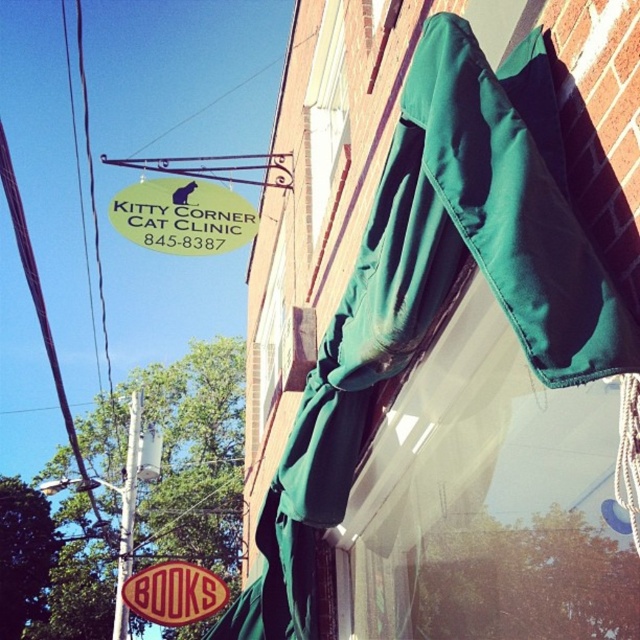
Question: Can you confirm if green fabric sign at upper left is bigger than metallic pole at upper left?

Choices:
 (A) no
 (B) yes

Answer: (A)

Question: Which object is positioned closest to the green fabric sign at upper left?

Choices:
 (A) metallic pole at upper left
 (B) red plastic books at lower center
 (C) green fabric awning at upper center
 (D) green fabric awning at upper right

Answer: (C)

Question: Which point appears farthest from the camera in this image?

Choices:
 (A) (188, 588)
 (B) (140, 394)

Answer: (B)

Question: Which point is farther to the camera?

Choices:
 (A) green fabric awning at upper right
 (B) green fabric sign at upper left
 (C) metallic pole at upper left

Answer: (C)

Question: Can you confirm if green fabric awning at upper right is positioned to the left of green fabric sign at upper left?

Choices:
 (A) yes
 (B) no

Answer: (B)

Question: Is green fabric sign at upper left wider than green fabric awning at upper center?

Choices:
 (A) yes
 (B) no

Answer: (A)